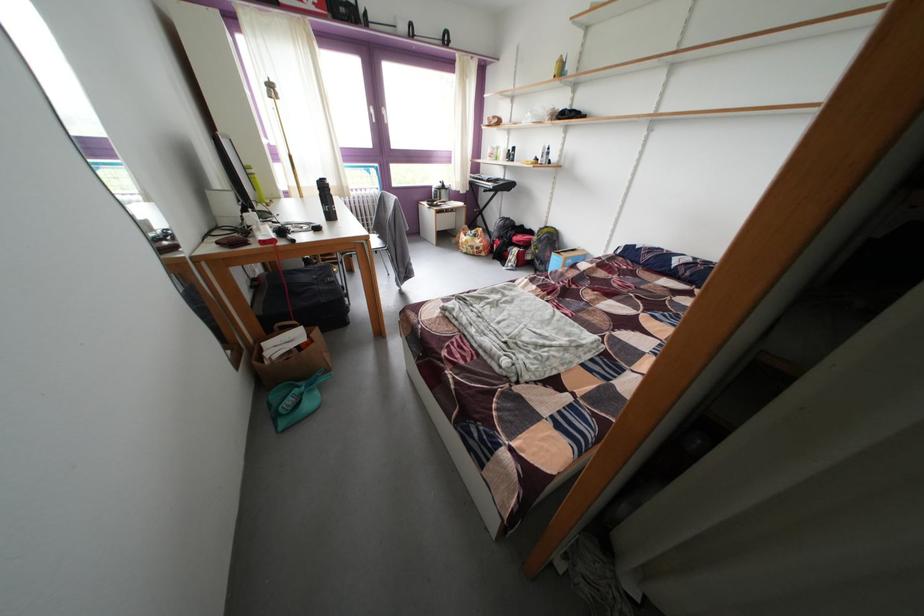
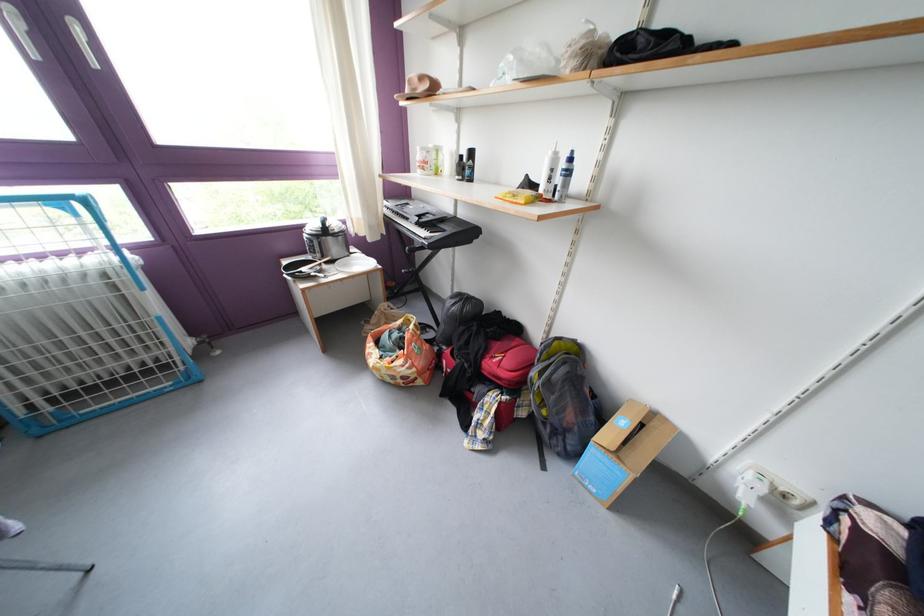
In the second image, find the point that corresponds to [447,211] in the first image.

(319, 283)